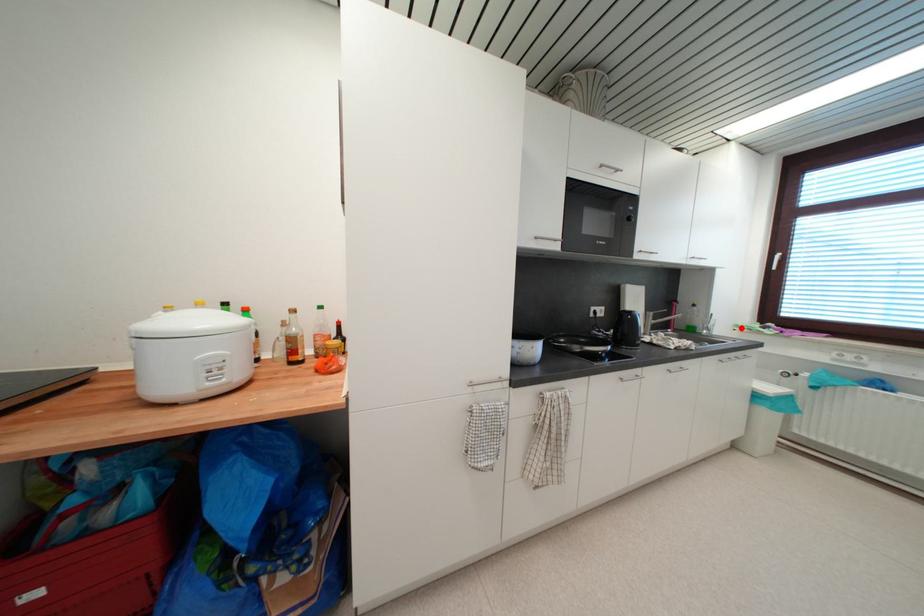
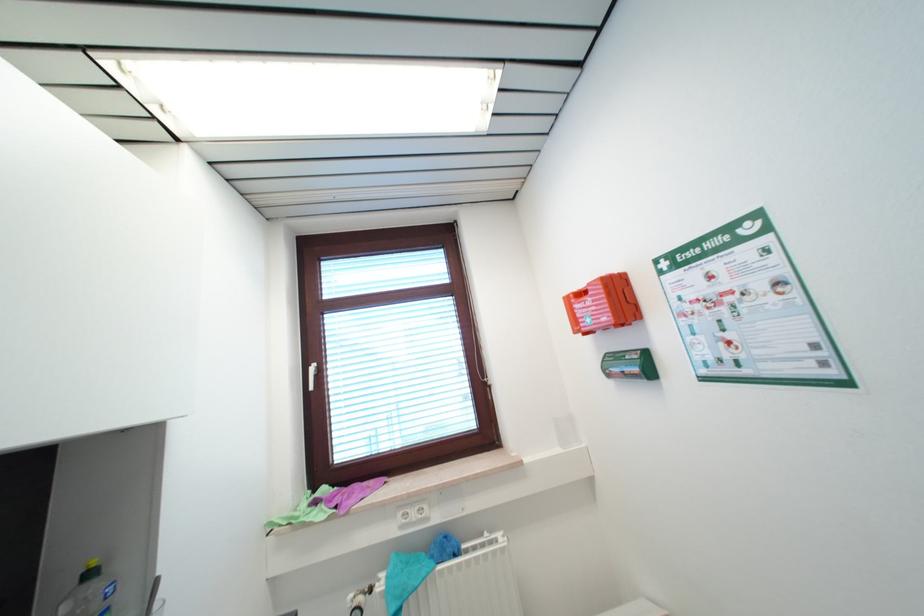
Where in the second image is the point corresponding to the highlighted location from the first image?

(274, 525)